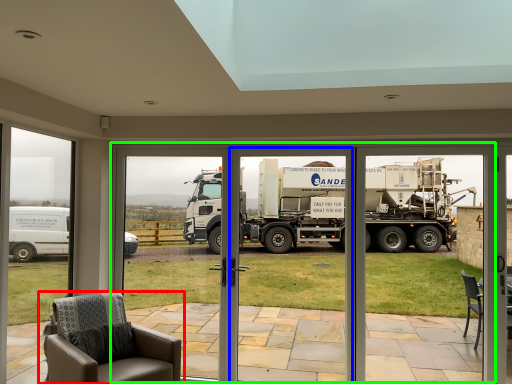
Question: Which object is positioned closest to chair (highlighted by a red box)? Select from garage door (highlighted by a blue box) and garage door (highlighted by a green box).

Choices:
 (A) garage door
 (B) garage door

Answer: (B)